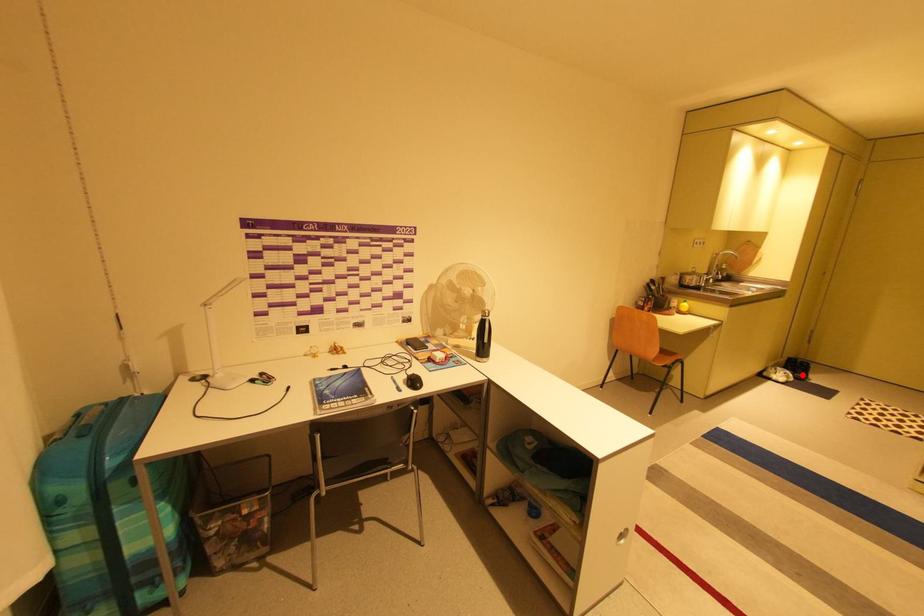
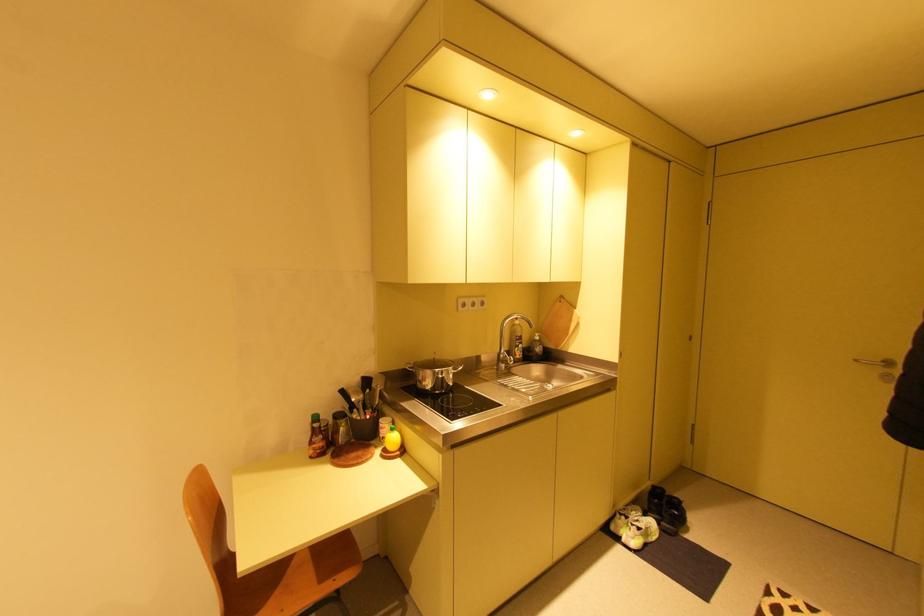
Question: I am providing you with two images of the same scene from different viewpoints. A red point is shown in image1. For the corresponding object point in image2, is it positioned nearer or farther from the camera?

Choices:
 (A) Nearer
 (B) Farther

Answer: (B)